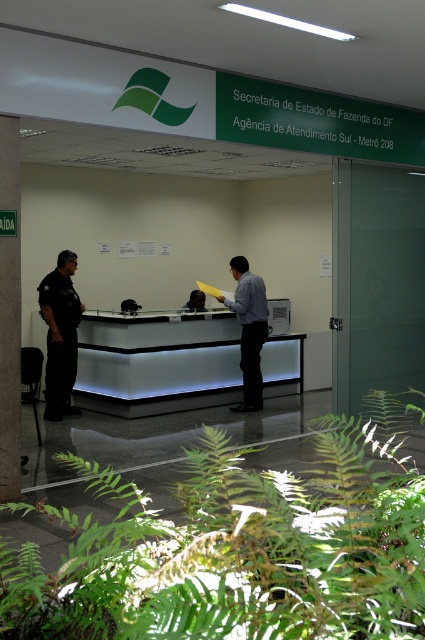
Question: Which point is farther to the camera?

Choices:
 (A) black uniform at left
 (B) light blue shirt at center
 (C) white glossy information desk at center
 (D) matte black laptop at center

Answer: (D)

Question: Can you confirm if black uniform at left is wider than light blue shirt at center?

Choices:
 (A) yes
 (B) no

Answer: (B)

Question: Which point is farther to the camera?

Choices:
 (A) (107, 316)
 (B) (248, 301)
 (C) (56, 259)

Answer: (C)

Question: Does white glossy information desk at center appear under matte black laptop at center?

Choices:
 (A) no
 (B) yes

Answer: (B)

Question: Does light blue shirt at center lie in front of matte black laptop at center?

Choices:
 (A) yes
 (B) no

Answer: (A)

Question: Which object is positioned farthest from the white glossy information desk at center?

Choices:
 (A) black uniform at left
 (B) light blue shirt at center
 (C) matte black laptop at center

Answer: (C)